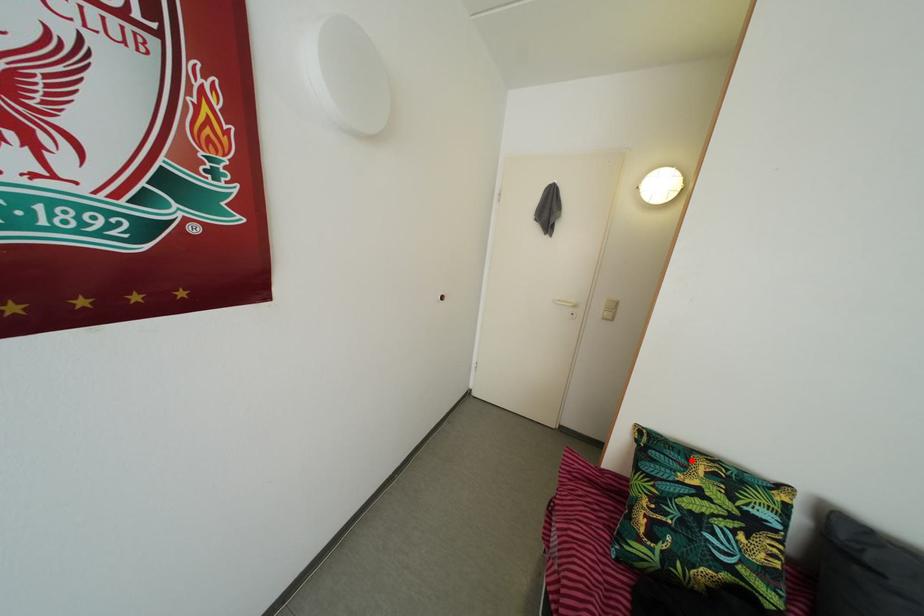
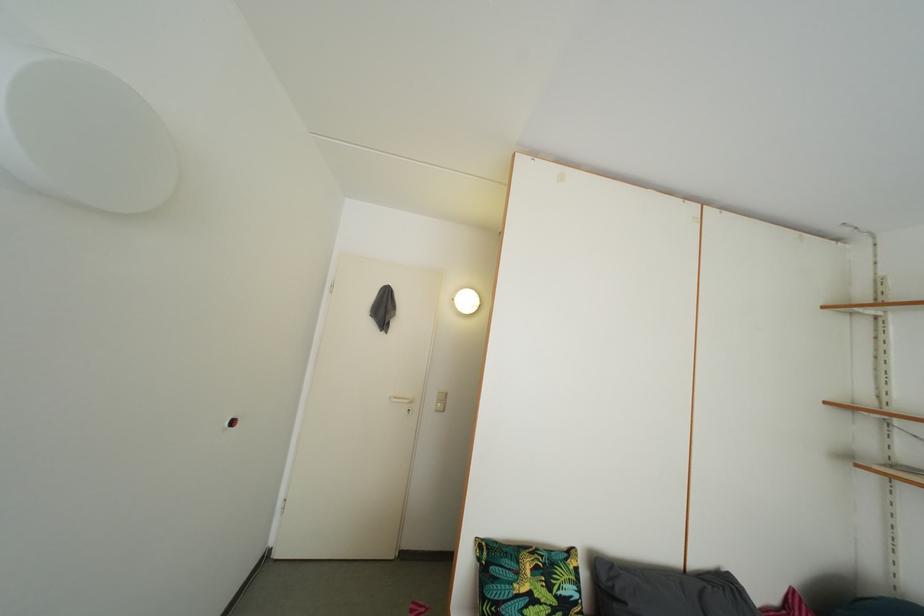
The point at the highlighted location is marked in the first image. Where is the corresponding point in the second image?

(521, 562)